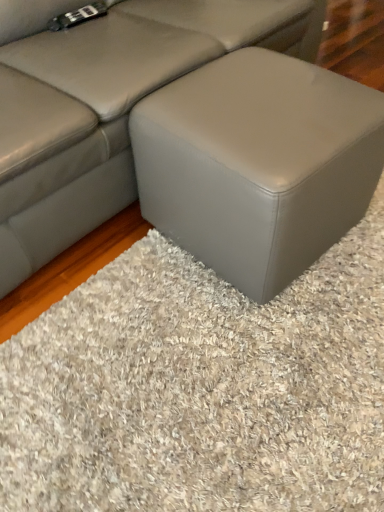
Question: Is matte gray ottoman at center positioned before matte gray ottoman at center?

Choices:
 (A) no
 (B) yes

Answer: (B)

Question: Is matte gray ottoman at center thinner than matte gray ottoman at center?

Choices:
 (A) yes
 (B) no

Answer: (B)

Question: Is matte gray ottoman at center far away from matte gray ottoman at center?

Choices:
 (A) no
 (B) yes

Answer: (A)

Question: Does matte gray ottoman at center come behind matte gray ottoman at center?

Choices:
 (A) no
 (B) yes

Answer: (A)

Question: Can you confirm if matte gray ottoman at center is smaller than matte gray ottoman at center?

Choices:
 (A) yes
 (B) no

Answer: (B)

Question: Is gray matte ottoman at center situated inside matte gray ottoman at center or outside?

Choices:
 (A) outside
 (B) inside

Answer: (A)

Question: Considering the positions of point (81, 340) and point (288, 4), is point (81, 340) closer or farther from the camera than point (288, 4)?

Choices:
 (A) farther
 (B) closer

Answer: (B)

Question: Based on their positions, is gray matte ottoman at center located to the left or right of matte gray ottoman at center?

Choices:
 (A) right
 (B) left

Answer: (A)

Question: In terms of width, does gray matte ottoman at center look wider or thinner when compared to matte gray ottoman at center?

Choices:
 (A) thin
 (B) wide

Answer: (A)

Question: Looking at the image, does matte gray ottoman at center seem bigger or smaller compared to gray matte ottoman at center?

Choices:
 (A) big
 (B) small

Answer: (A)

Question: Is point (187, 134) positioned closer to the camera than point (276, 472)?

Choices:
 (A) closer
 (B) farther

Answer: (B)

Question: From their relative heights in the image, would you say matte gray ottoman at center is taller or shorter than gray matte ottoman at center?

Choices:
 (A) short
 (B) tall

Answer: (B)

Question: Based on their positions, is matte gray ottoman at center located to the left or right of gray matte ottoman at center?

Choices:
 (A) left
 (B) right

Answer: (A)

Question: In the image, is matte gray ottoman at center on the left side or the right side of matte gray ottoman at center?

Choices:
 (A) left
 (B) right

Answer: (A)

Question: From the image's perspective, is matte gray ottoman at center positioned above or below matte gray ottoman at center?

Choices:
 (A) below
 (B) above

Answer: (B)